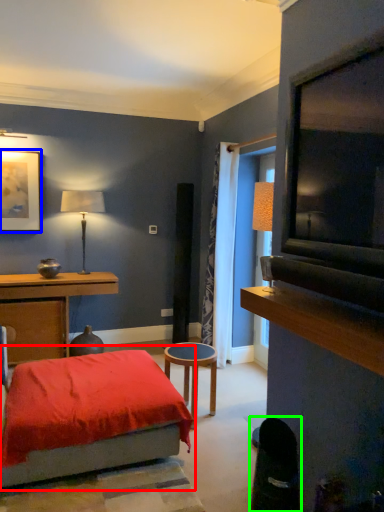
Question: Which is farther away from bed (highlighted by a red box)? picture frame (highlighted by a blue box) or swivel chair (highlighted by a green box)?

Choices:
 (A) picture frame
 (B) swivel chair

Answer: (A)